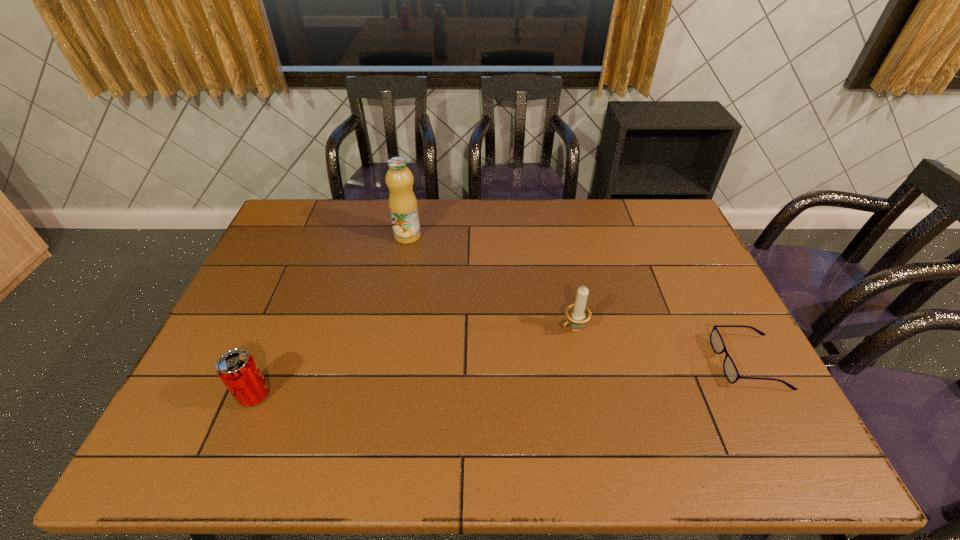
Locate an element on the screen. soda can is located at coordinates (237, 369).

Identify the location of the rightmost object. This screenshot has width=960, height=540. click(729, 367).

The width and height of the screenshot is (960, 540). What are the coordinates of `spectacles` in the screenshot? It's located at (729, 367).

The width and height of the screenshot is (960, 540). I want to click on the third object from right to left, so click(403, 207).

The width and height of the screenshot is (960, 540). What are the coordinates of `fruit juice` in the screenshot? It's located at pyautogui.click(x=403, y=207).

You are a GUI agent. You are given a task and a screenshot of the screen. Output one action in this format:
    pyautogui.click(x=<x>, y=<y>)
    Task: Click on the candle_holder
    This screenshot has height=540, width=960.
    Given the screenshot: What is the action you would take?
    pyautogui.click(x=578, y=313)

This screenshot has width=960, height=540. In order to click on free space located on the right of the leftmost object in this screenshot , I will do `click(314, 395)`.

Locate an element on the screen. Image resolution: width=960 pixels, height=540 pixels. vacant space located 0.200m on the front-facing side of the spectacles is located at coordinates coord(643,363).

Identify the location of vacant space located on the front-facing side of the spectacles. The image size is (960, 540). (616, 363).

Where is `vacant region located 0.080m on the front-facing side of the spectacles`? The width and height of the screenshot is (960, 540). vacant region located 0.080m on the front-facing side of the spectacles is located at coordinates (688, 363).